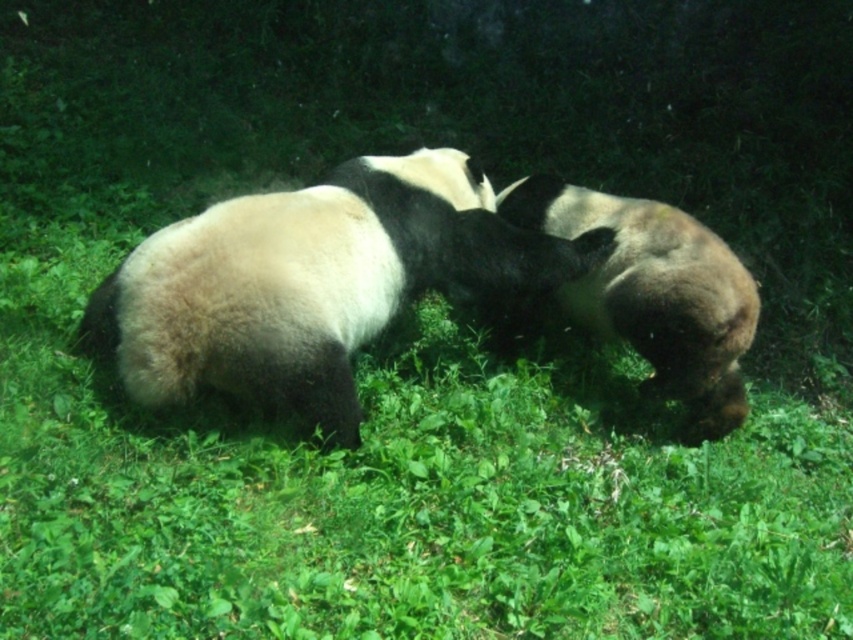
Question: Is black and white fur panda at center below black fuzzy panda at right?

Choices:
 (A) no
 (B) yes

Answer: (A)

Question: Does black and white fur panda at center have a larger size compared to black fuzzy panda at right?

Choices:
 (A) yes
 (B) no

Answer: (A)

Question: Which object is closer to the camera taking this photo?

Choices:
 (A) black fuzzy panda at right
 (B) black and white fur panda at center

Answer: (B)

Question: Which point appears farthest from the camera in this image?

Choices:
 (A) (149, 380)
 (B) (544, 196)

Answer: (B)

Question: From the image, what is the correct spatial relationship of black and white fur panda at center in relation to black fuzzy panda at right?

Choices:
 (A) left
 (B) right

Answer: (A)